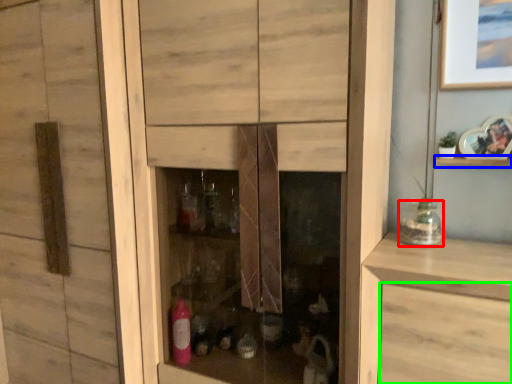
Question: Which is nearer to the glass jar (highlighted by a red box)? shelf (highlighted by a blue box) or drawer (highlighted by a green box).

Choices:
 (A) shelf
 (B) drawer

Answer: (A)